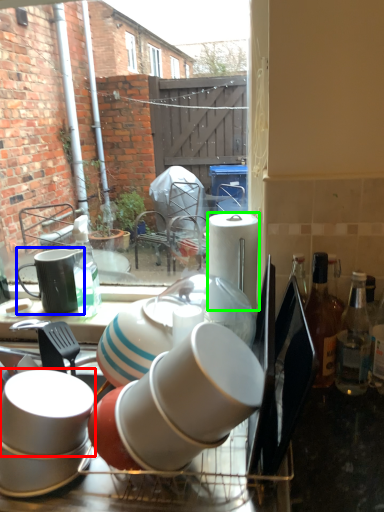
Question: Considering the real-world distances, which object is farthest from coffee cup (highlighted by a red box)? tableware (highlighted by a blue box) or paper towel (highlighted by a green box)?

Choices:
 (A) tableware
 (B) paper towel

Answer: (B)